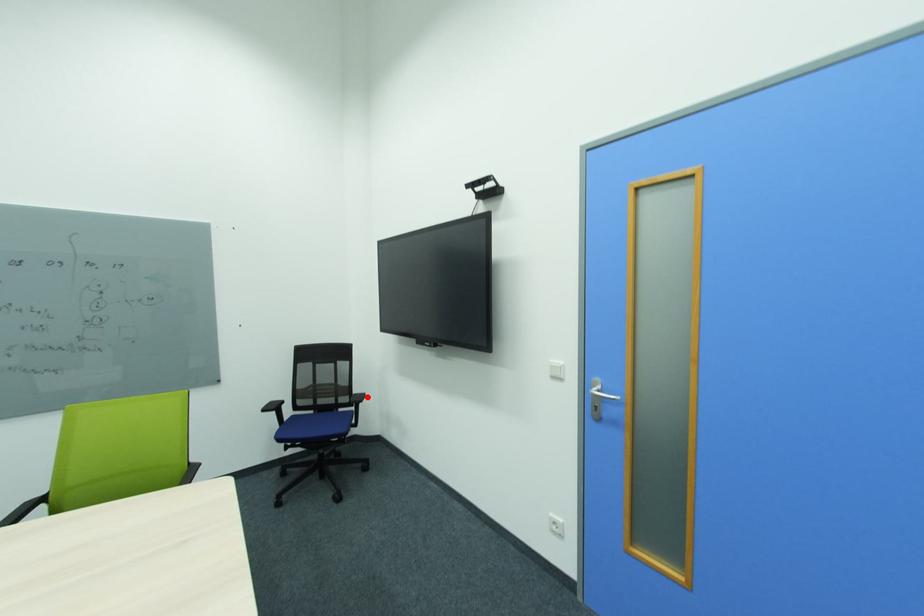
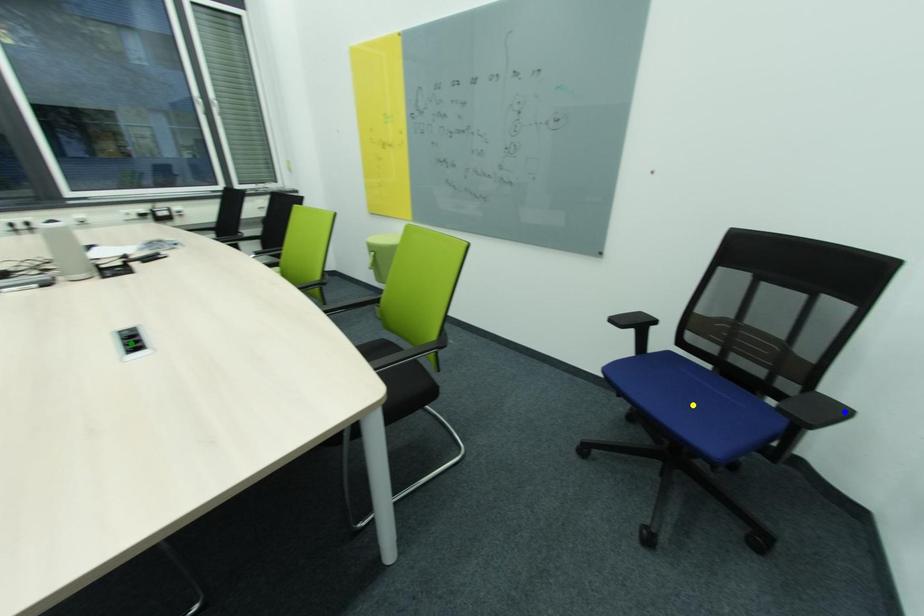
Question: I am providing you with two images of the same scene from different viewpoints. A red point is marked on the first image. You are given multiple points on the second image. Which point in image 2 is actually the same real-world point as the red point in image 1?

Choices:
 (A) blue point
 (B) green point
 (C) yellow point

Answer: (A)